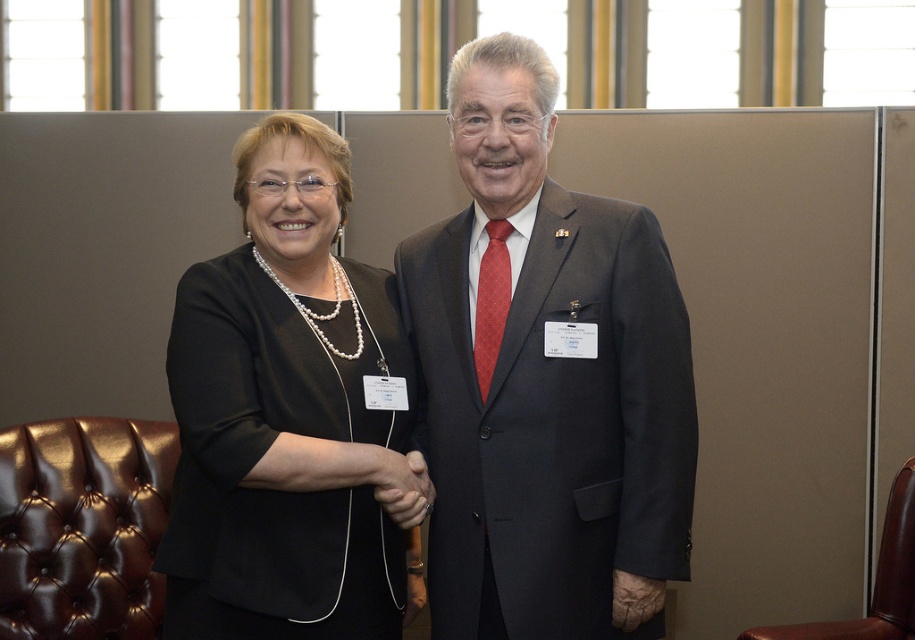
You are attending a conference and need to sit down. There is a matte black suit at center and a brown leather armchair at right. Which object is closer to your current position if you are standing to the left of both objects?

The matte black suit at center is closer to your current position because it is to the left of the brown leather armchair at right, placing it nearer to your left side.

You are standing in a room where two people are shaking hands. There is a specific point at coordinates point (622, 506). If you want to place a small decoration exactly 2 meters away from that point, will it be within the room?

The distance between point (622, 506) and the viewer is 2.06 meters. Since 2 meters is slightly less than 2.06 meters, placing the decoration 2 meters from the point would be within the room.

You are attending a formal event and need to sit down. You see a matte black suit at center and a brown leather armchair at right. Which object is higher in position?

The matte black suit at center is above the brown leather armchair at right, so the matte black suit at center is higher in position.